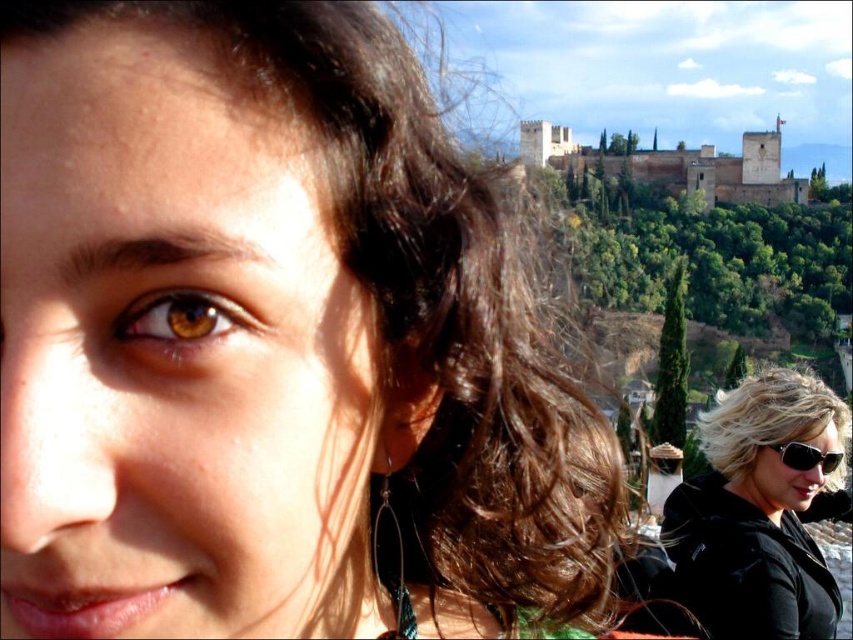
Question: Does brown glossy eye at center have a larger size compared to black plastic sunglasses at right?

Choices:
 (A) no
 (B) yes

Answer: (B)

Question: Does black matte sunglasses at lower right have a smaller size compared to black plastic sunglasses at right?

Choices:
 (A) yes
 (B) no

Answer: (B)

Question: Does blonde hair at right lie behind black plastic sunglasses at right?

Choices:
 (A) no
 (B) yes

Answer: (A)

Question: Which of the following is the farthest from the observer?

Choices:
 (A) brown glossy eye at center
 (B) blonde hair at right
 (C) black matte sunglasses at lower right
 (D) black plastic sunglasses at right

Answer: (D)

Question: Which of the following is the farthest from the observer?

Choices:
 (A) (724, 396)
 (B) (825, 458)

Answer: (A)

Question: Among these objects, which one is nearest to the camera?

Choices:
 (A) black matte sunglasses at lower right
 (B) brown glossy eye at center

Answer: (B)